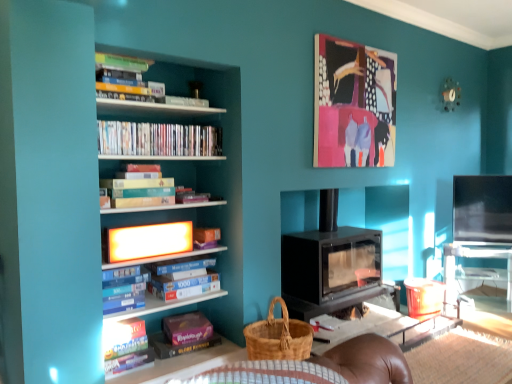
Question: Is bright orange plastic shelf at upper center inside woven brown basket at lower center?

Choices:
 (A) yes
 (B) no

Answer: (B)

Question: Is woven brown basket at lower center oriented towards bright orange plastic shelf at upper center?

Choices:
 (A) yes
 (B) no

Answer: (B)

Question: Does woven brown basket at lower center appear on the right side of bright orange plastic shelf at upper center?

Choices:
 (A) yes
 (B) no

Answer: (A)

Question: From a real-world perspective, does woven brown basket at lower center sit lower than bright orange plastic shelf at upper center?

Choices:
 (A) no
 (B) yes

Answer: (B)

Question: Considering the relative positions of woven brown basket at lower center and bright orange plastic shelf at upper center in the image provided, is woven brown basket at lower center in front of bright orange plastic shelf at upper center?

Choices:
 (A) no
 (B) yes

Answer: (B)

Question: In the image, is woven brown basket at lower center positioned in front of or behind matte cardboard book at lower left, which is counted as the first book, starting from the bottom?

Choices:
 (A) front
 (B) behind

Answer: (A)

Question: From a real-world perspective, relative to matte cardboard book at lower left, which is counted as the first book, starting from the bottom, is woven brown basket at lower center vertically above or below?

Choices:
 (A) below
 (B) above

Answer: (B)

Question: Looking at their shapes, would you say woven brown basket at lower center is wider or thinner than matte cardboard book at lower left, positioned as the 5th book in top-to-bottom order?

Choices:
 (A) thin
 (B) wide

Answer: (B)

Question: From the image's perspective, is woven brown basket at lower center above or below matte cardboard book at lower left, positioned as the 5th book in top-to-bottom order?

Choices:
 (A) below
 (B) above

Answer: (B)

Question: In the image, is matte cardboard book at lower left, which is counted as the first book, starting from the bottom, positioned in front of or behind black matte wood burning stove at center?

Choices:
 (A) front
 (B) behind

Answer: (A)

Question: From the image's perspective, is matte cardboard book at lower left, positioned as the 5th book in top-to-bottom order, above or below black matte wood burning stove at center?

Choices:
 (A) above
 (B) below

Answer: (B)

Question: From a real-world perspective, relative to black matte wood burning stove at center, is matte cardboard book at lower left, which is counted as the first book, starting from the bottom, vertically above or below?

Choices:
 (A) above
 (B) below

Answer: (B)

Question: Is matte cardboard book at lower left, positioned as the 5th book in top-to-bottom order, taller or shorter than black matte wood burning stove at center?

Choices:
 (A) short
 (B) tall

Answer: (A)

Question: Is point (312, 304) closer or farther from the camera than point (112, 332)?

Choices:
 (A) closer
 (B) farther

Answer: (B)

Question: Is black matte wood burning stove at center inside or outside of matte cardboard book at lower left, positioned as the 5th book in top-to-bottom order?

Choices:
 (A) outside
 (B) inside

Answer: (A)